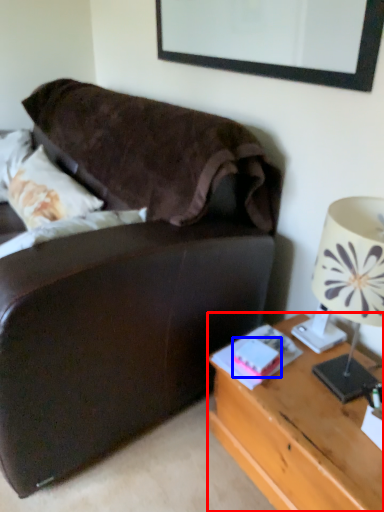
Question: Which point is further to the camera, desk (highlighted by a red box) or book (highlighted by a blue box)?

Choices:
 (A) desk
 (B) book

Answer: (B)